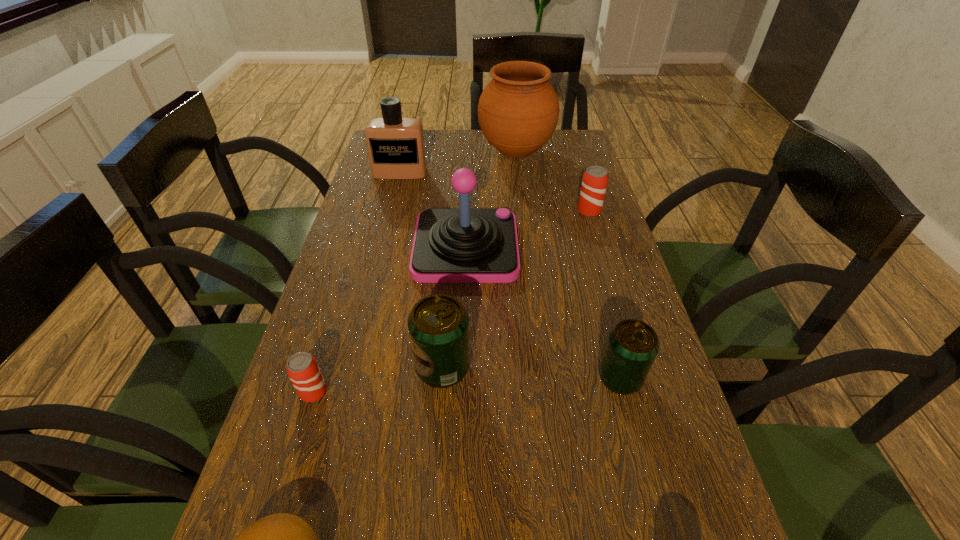
Find the location of a particular element. The width and height of the screenshot is (960, 540). beer can that is the third closest to the shortest beer can is located at coordinates (595, 178).

The image size is (960, 540). What are the coordinates of `green beer can that is the second closest to the leftmost beer can` in the screenshot? It's located at (632, 345).

Image resolution: width=960 pixels, height=540 pixels. I want to click on free space that satisfies the following two spatial constraints: 1. on the front label of the left green beer can; 2. on the right side of the perfume, so 351,367.

You are a GUI agent. You are given a task and a screenshot of the screen. Output one action in this format:
    pyautogui.click(x=<x>, y=<y>)
    Task: Click on the vacant area in the image that satisfies the following two spatial constraints: 1. forward from the base of the right green beer can; 2. on the left side of the joystick
    This screenshot has width=960, height=540.
    Given the screenshot: What is the action you would take?
    pyautogui.click(x=461, y=377)